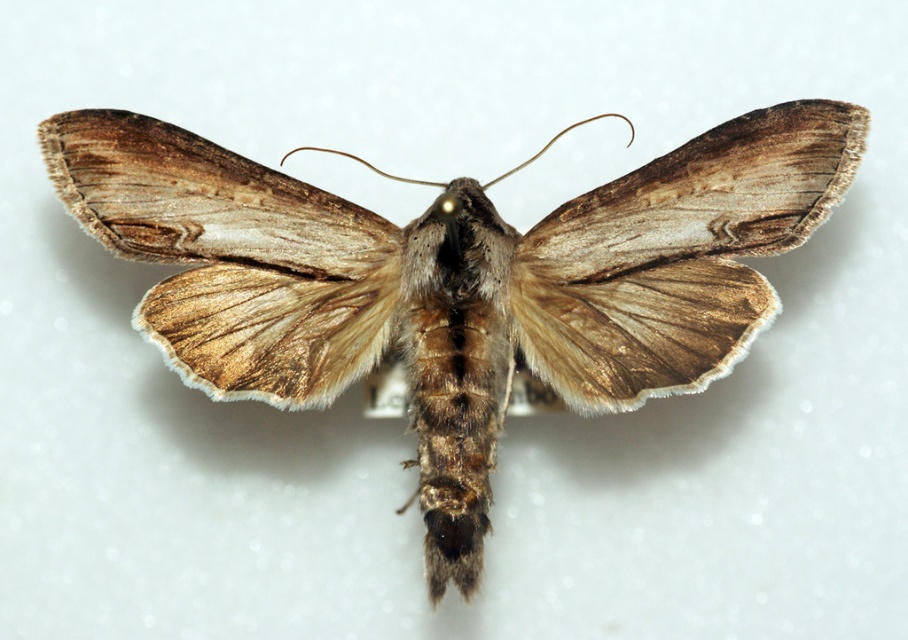
You are holding a camera and want to take a photo of the brown textured moth at center. If the camera can focus on objects within 1 meter, will it be able to capture the moth clearly?

The brown textured moth at center is 1.32 meters away from the camera, which is beyond the camera focus range of 1 meter. Therefore, the camera will not be able to capture the moth clearly.

You are an entomologist examining the brown textured moth at center and the brown fuzzy moth wing at center. Which object is closer to your viewpoint?

The brown textured moth at center is closer to your viewpoint because the brown fuzzy moth wing at center is positioned behind it.